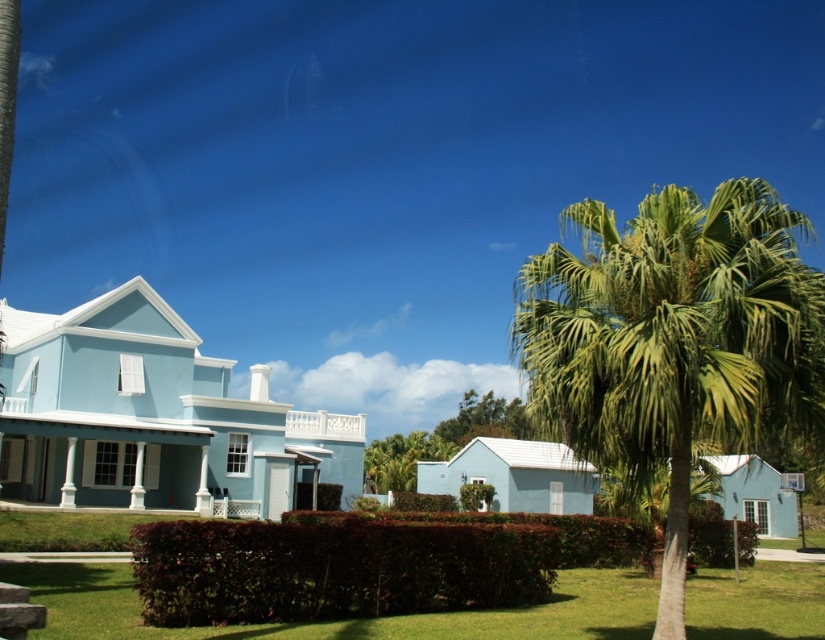
Question: Among these points, which one is farthest from the camera?

Choices:
 (A) (196, 554)
 (B) (798, 220)
 (C) (390, 458)

Answer: (C)

Question: Is green leafy palm tree at right behind green leafy tree at center?

Choices:
 (A) no
 (B) yes

Answer: (A)

Question: Where is dark green leafy hedge at center located in relation to green leafy tree at center in the image?

Choices:
 (A) below
 (B) above

Answer: (B)

Question: Which of the following is the closest to the observer?

Choices:
 (A) (206, 564)
 (B) (816, 600)
 (C) (437, 428)

Answer: (A)

Question: Among these objects, which one is farthest from the camera?

Choices:
 (A) green grass at lower center
 (B) green leafy tree at center
 (C) green leafy palm tree at right

Answer: (B)

Question: Does green leafy palm tree at right appear over green leafy tree at center?

Choices:
 (A) no
 (B) yes

Answer: (B)